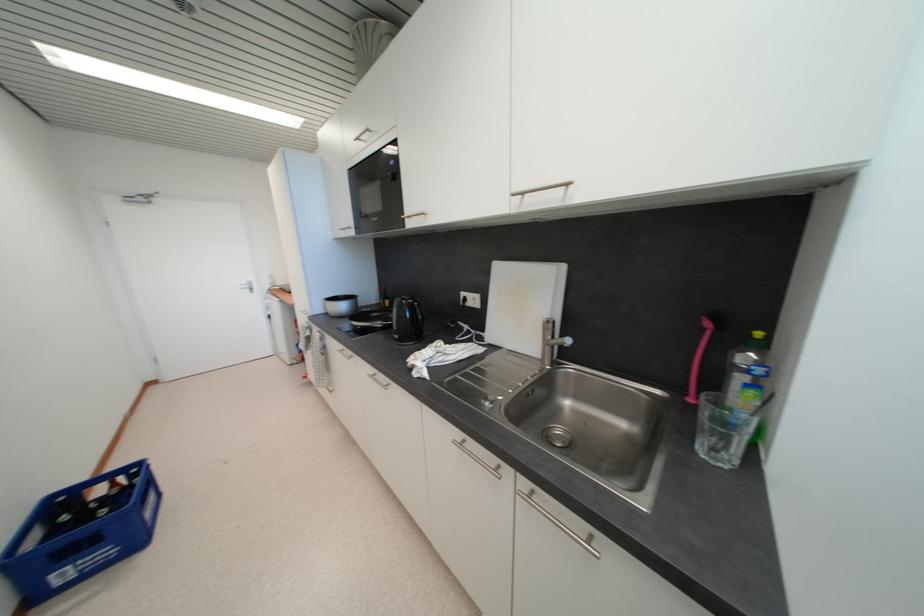
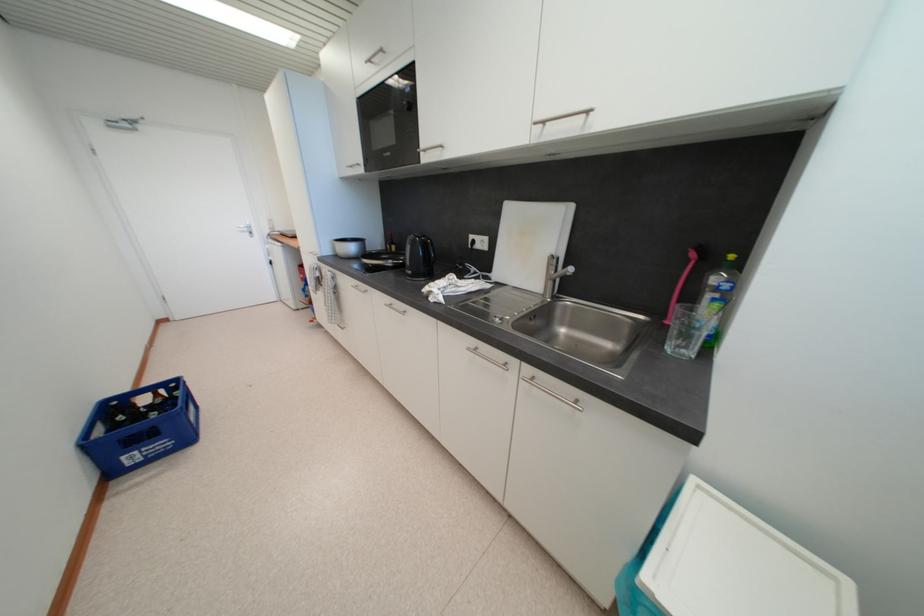
Where in the second image is the point corresponding to pixel 720 453 from the first image?

(685, 349)